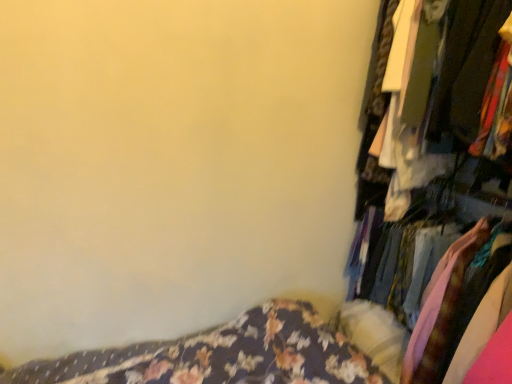
This screenshot has height=384, width=512. Find the location of `textured fabric clothes at right`. textured fabric clothes at right is located at coordinates (480, 35).

The height and width of the screenshot is (384, 512). What do you see at coordinates (480, 35) in the screenshot?
I see `textured fabric clothes at right` at bounding box center [480, 35].

The image size is (512, 384). I want to click on textured fabric clothes at right, so click(x=480, y=35).